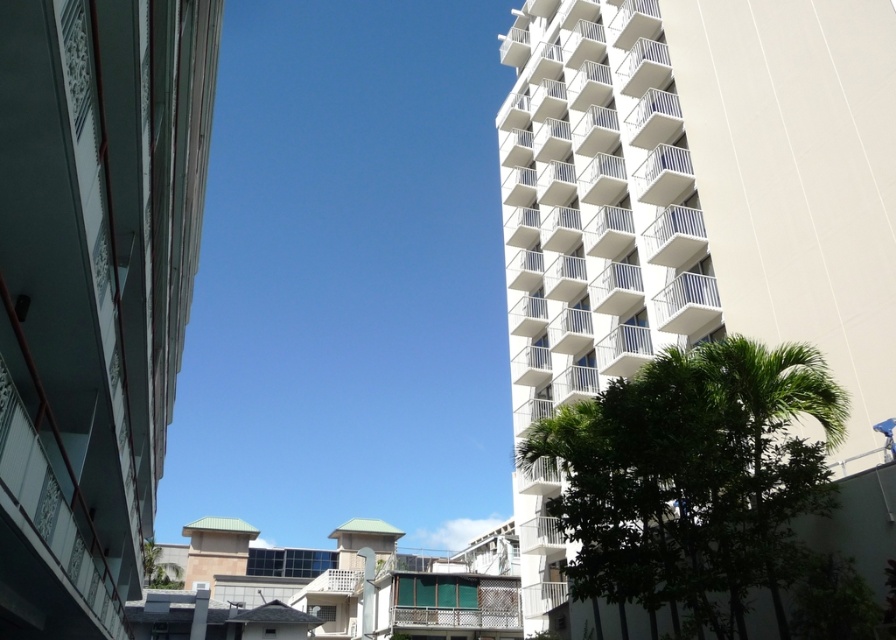
Between point (672, 244) and point (93, 563), which one is positioned in front?

Point (93, 563) is more forward.

The height and width of the screenshot is (640, 896). I want to click on white smooth building at right, so click(x=700, y=193).